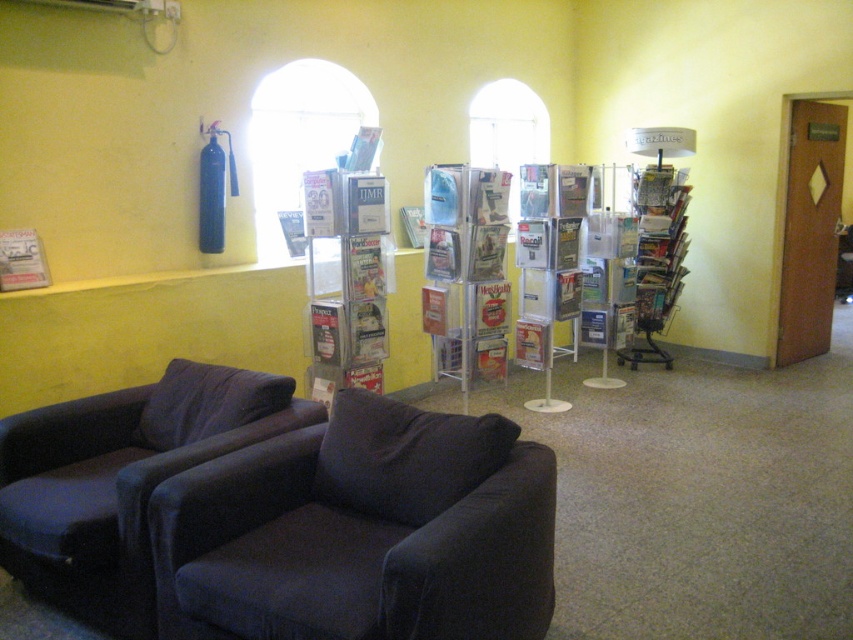
Question: Which point is closer to the camera?

Choices:
 (A) dark blue fabric armchair at lower left
 (B) metallic silver magazine rack at center-right

Answer: (A)

Question: Is dark blue fabric armchair at lower left bigger than metallic silver magazine rack at center-right?

Choices:
 (A) yes
 (B) no

Answer: (A)

Question: Which point is closer to the camera?

Choices:
 (A) matte paper magazine at left
 (B) dark blue fabric armchair at lower left
 (C) dark blue fabric couch at lower left

Answer: (B)

Question: Which point is closer to the camera?

Choices:
 (A) matte paper magazine at left
 (B) dark blue fabric couch at lower left
 (C) dark blue fabric armchair at lower left
 (D) metallic silver magazine rack at center-right

Answer: (C)

Question: Does metallic silver magazine rack at center-right come in front of matte paper magazine at left?

Choices:
 (A) no
 (B) yes

Answer: (A)

Question: Can you confirm if dark blue fabric couch at lower left is bigger than matte paper magazine at left?

Choices:
 (A) no
 (B) yes

Answer: (B)